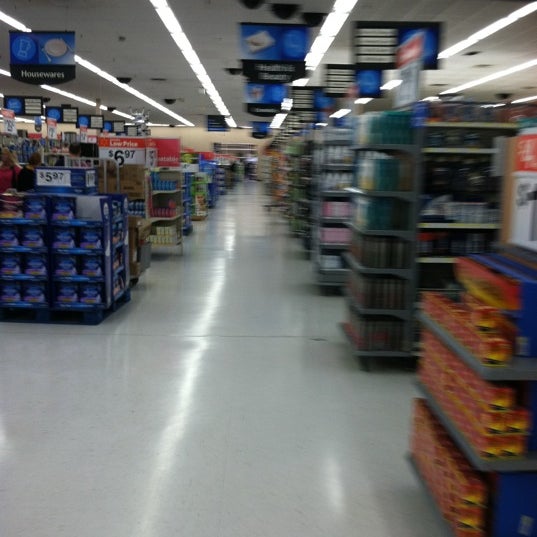
Image resolution: width=537 pixels, height=537 pixels. In order to click on shelf in this screenshot , I will do `click(514, 352)`.